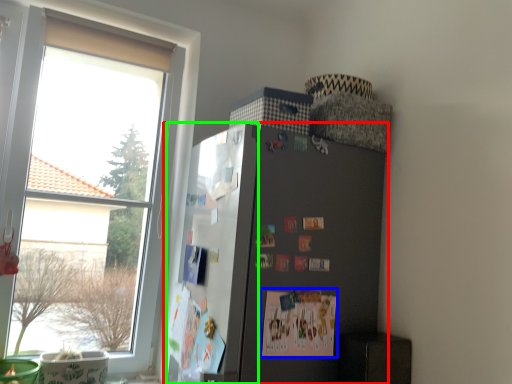
Question: Which is nearer to the refrigerator (highlighted by a red box)? postcard (highlighted by a blue box) or bulletin board (highlighted by a green box).

Choices:
 (A) postcard
 (B) bulletin board

Answer: (B)